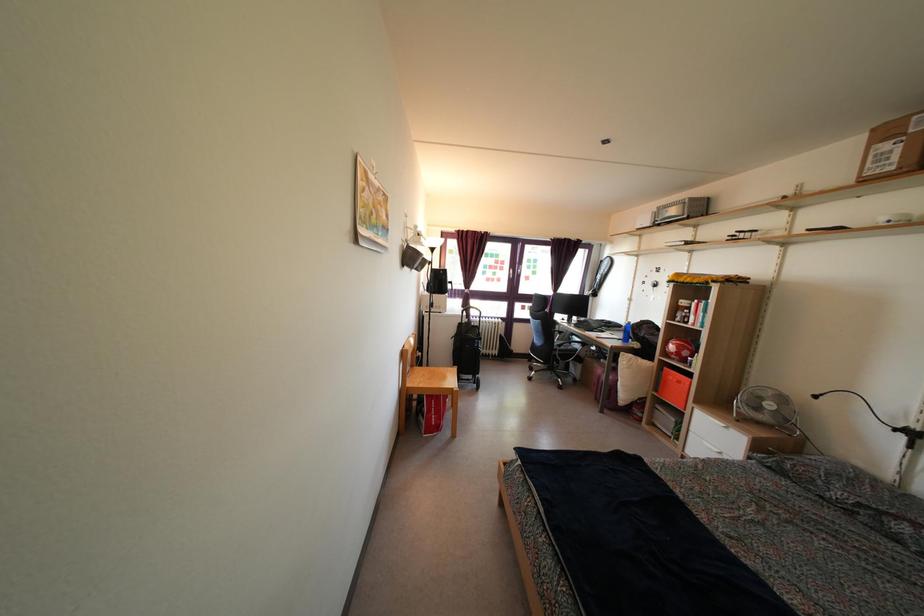
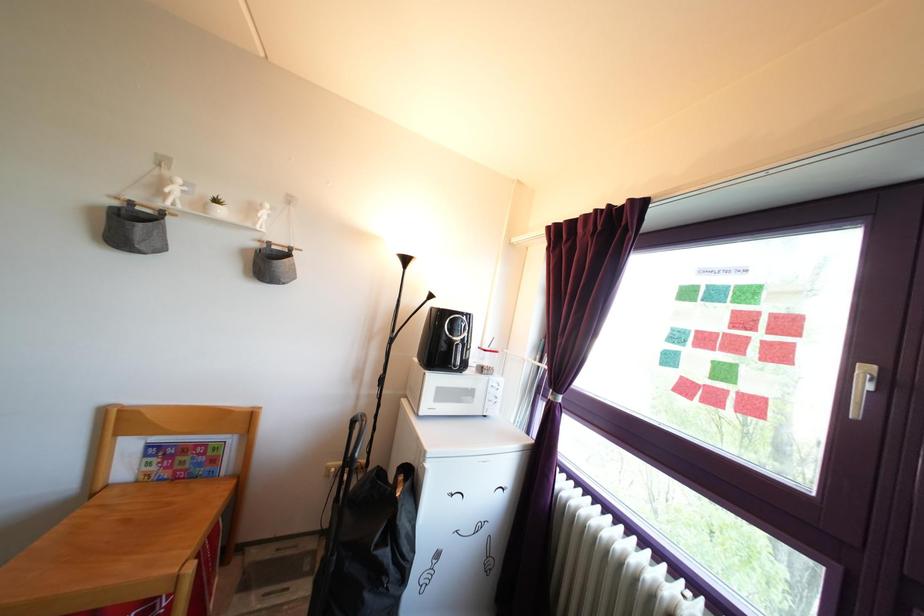
Locate, in the second image, the point that corresponds to (502,274) in the first image.

(761, 345)